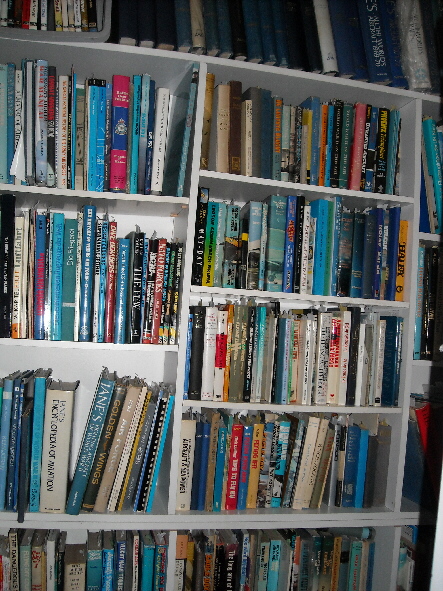
This screenshot has height=591, width=443. I want to click on books in upper left corner, so click(x=12, y=14), click(x=62, y=22), click(x=93, y=17), click(x=46, y=14).